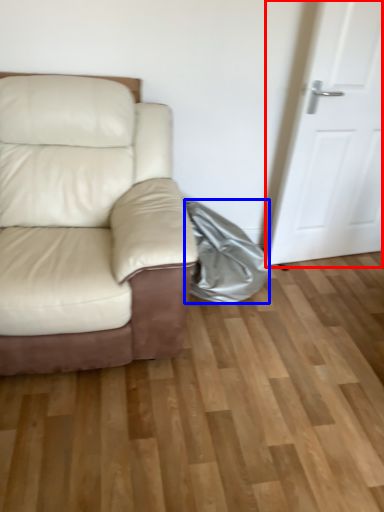
Question: Which point is closer to the camera, door (highlighted by a red box) or material (highlighted by a blue box)?

Choices:
 (A) door
 (B) material

Answer: (A)